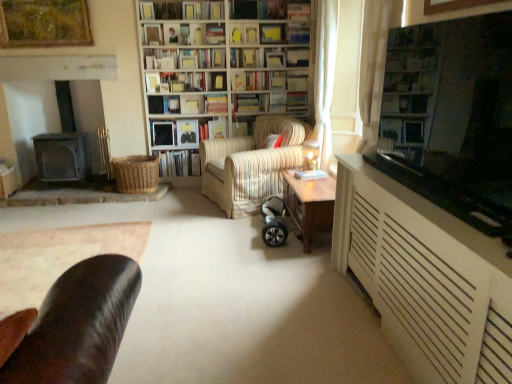
At what (x,y) coordinates should I click in order to perform the action: click on vacant space to the left of silver metallic hoverboard at center. Please return your answer as a coordinate pair (x, y). The width and height of the screenshot is (512, 384). Looking at the image, I should click on (227, 233).